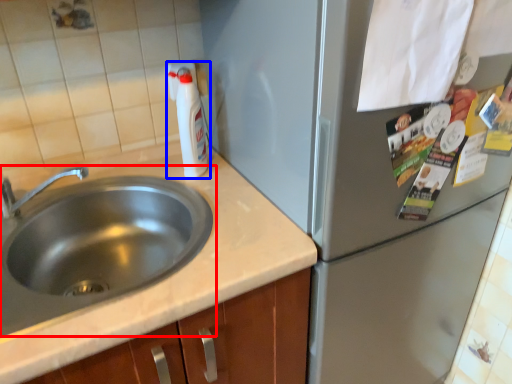
Question: Which point is further to the camera, sink (highlighted by a red box) or bottle (highlighted by a blue box)?

Choices:
 (A) sink
 (B) bottle

Answer: (B)